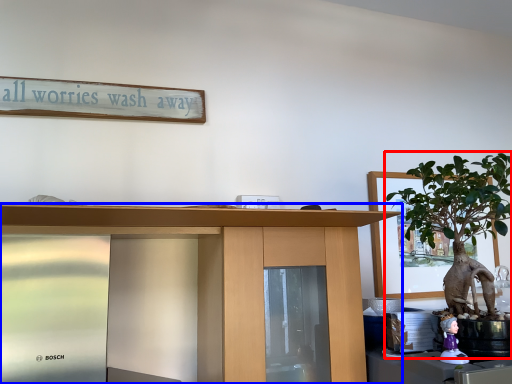
Question: Which object is closer to the camera taking this photo, houseplant (highlighted by a red box) or desk (highlighted by a blue box)?

Choices:
 (A) houseplant
 (B) desk

Answer: (B)